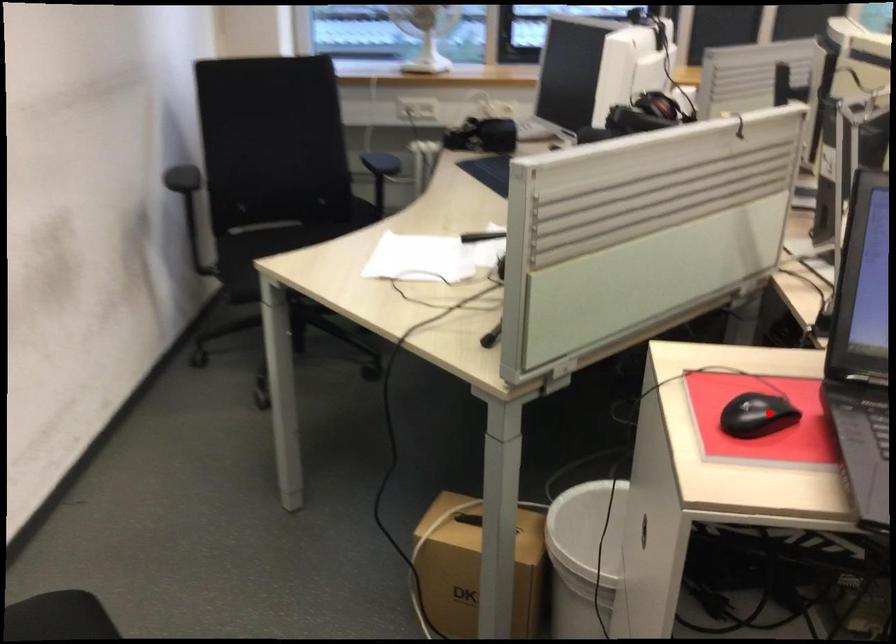
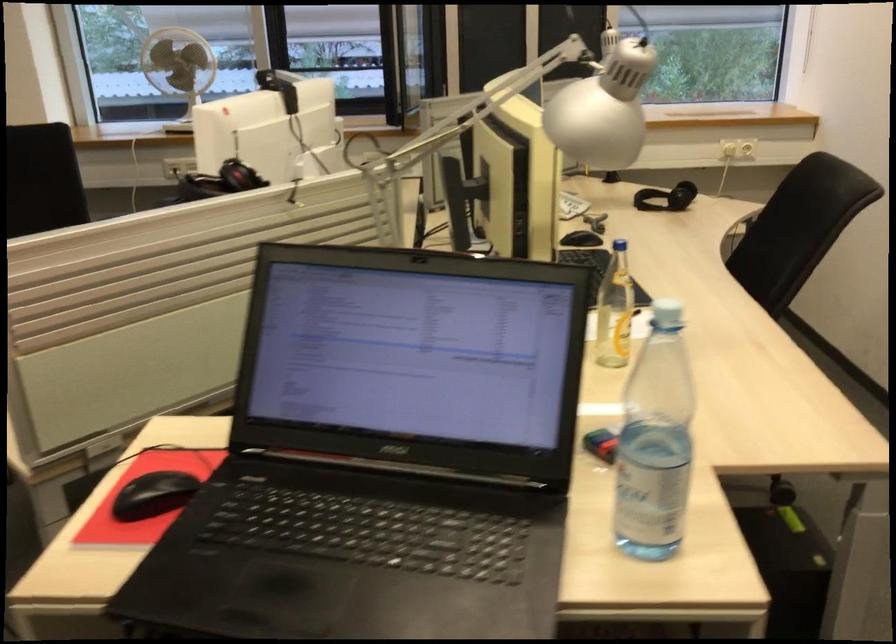
Locate, in the second image, the point that corresponds to the highlighted location in the first image.

(153, 495)